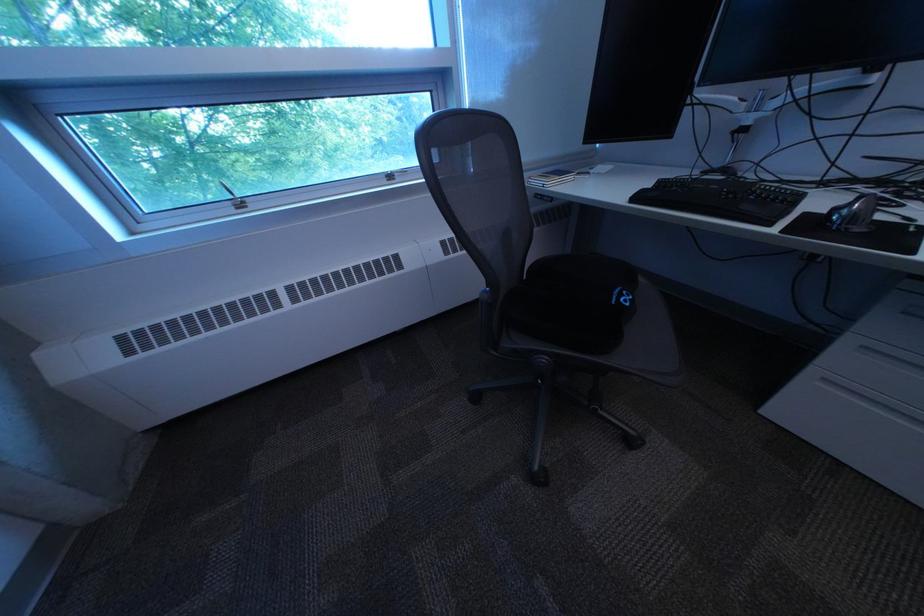
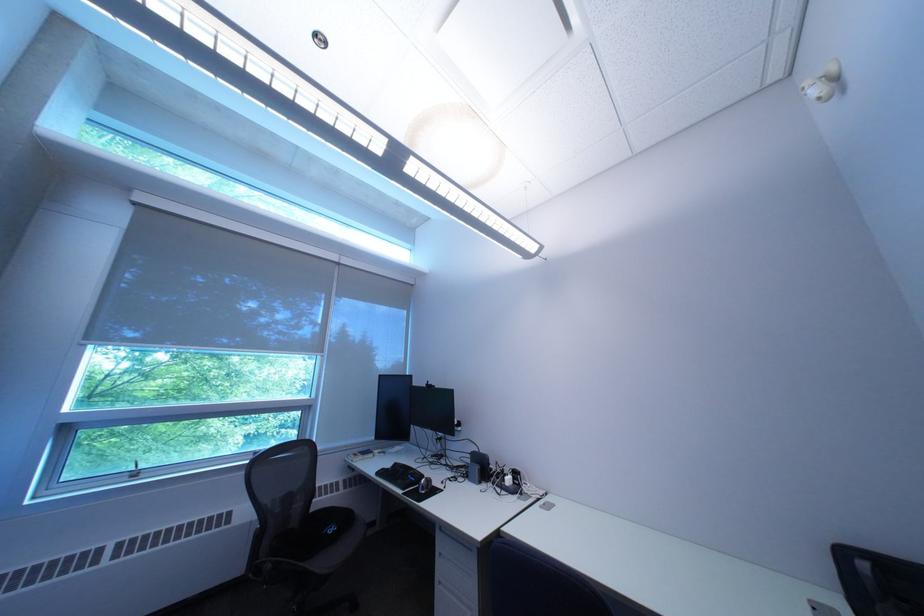
In the second image, find the point that corresponds to pixel 650 200 in the first image.

(393, 475)